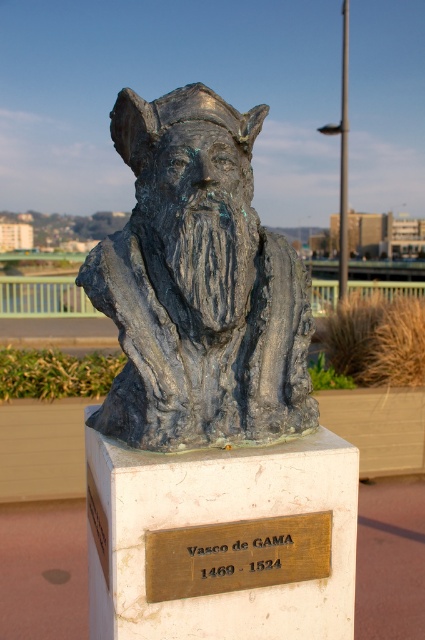
Can you confirm if bronze bust at center is thinner than gold-bronze plaque at center?

Incorrect, bronze bust at center's width is not less than gold-bronze plaque at center's.

Is bronze bust at center further to the viewer compared to gold-bronze plaque at center?

Yes, it is.

Between point (201, 326) and point (167, 573), which one is positioned behind?

Positioned behind is point (201, 326).

Image resolution: width=425 pixels, height=640 pixels. What are the coordinates of `bronze bust at center` in the screenshot? It's located at (198, 285).